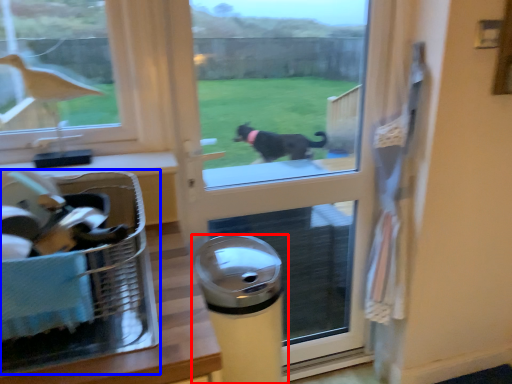
Question: Which object appears closest to the camera in this image, waste container (highlighted by a red box) or laundry basket (highlighted by a blue box)?

Choices:
 (A) waste container
 (B) laundry basket

Answer: (B)